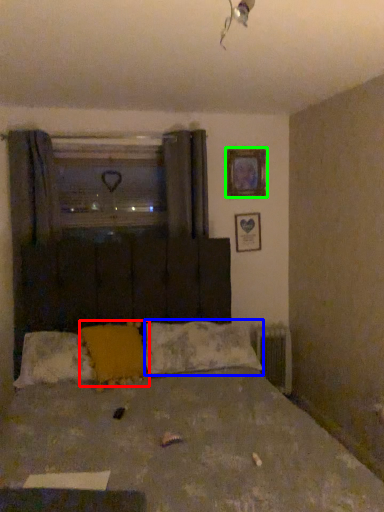
Question: Estimate the real-world distances between objects in this image. Which object is farther from pillow (highlighted by a red box), pillow (highlighted by a blue box) or picture frame (highlighted by a green box)?

Choices:
 (A) pillow
 (B) picture frame

Answer: (B)